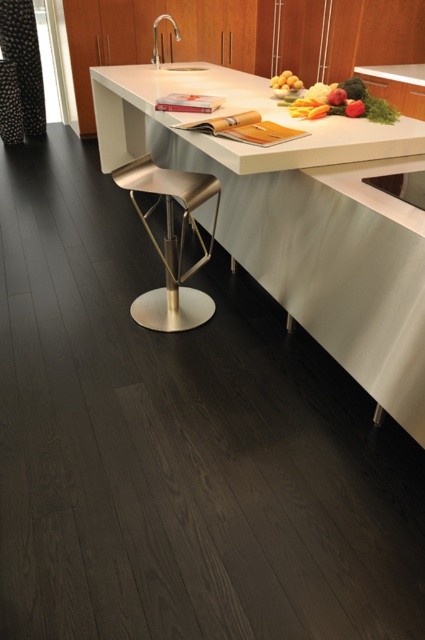
The height and width of the screenshot is (640, 425). What are the coordinates of `white glossy countertop at center` in the screenshot? It's located at (300, 218).

Does white glossy countertop at center lie in front of vibrant mixed vegetables at center?

Yes, it is.

Describe the element at coordinates (300, 218) in the screenshot. The height and width of the screenshot is (640, 425). I see `white glossy countertop at center` at that location.

Locate an element on the screen. This screenshot has width=425, height=640. white glossy countertop at center is located at coordinates (300, 218).

Is point (19, 124) farther from viewer compared to point (283, 81)?

That is True.

Between black textured curtain at left and yellow matte potatoes at upper center, which one has more height?

black textured curtain at left is taller.

Locate an element on the screen. black textured curtain at left is located at coordinates (19, 74).

You are a GUI agent. You are given a task and a screenshot of the screen. Output one action in this format:
    pyautogui.click(x=<x>, y=<y>)
    Task: Click on the black textured curtain at left
    The height and width of the screenshot is (640, 425).
    Given the screenshot: What is the action you would take?
    pyautogui.click(x=19, y=74)

Looking at this image, how distant is vibrant mixed vegetables at center from yellow matte potatoes at upper center?

vibrant mixed vegetables at center and yellow matte potatoes at upper center are 12.36 inches apart from each other.

I want to click on vibrant mixed vegetables at center, so click(x=333, y=99).

Does point (379, 102) lie in front of point (283, 77)?

Yes, point (379, 102) is closer to viewer.

At what (x,y) coordinates should I click in order to perform the action: click on vibrant mixed vegetables at center. Please return your answer as a coordinate pair (x, y). The width and height of the screenshot is (425, 640). Looking at the image, I should click on (333, 99).